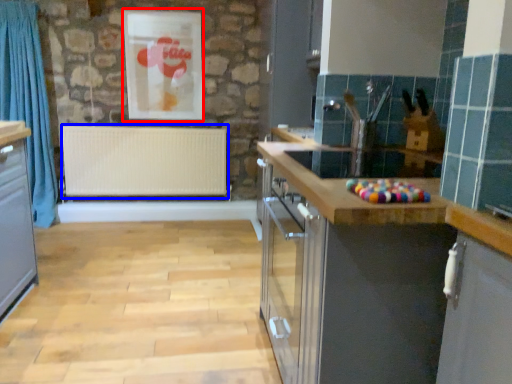
Question: Which point is closer to the camera, picture frame (highlighted by a red box) or radiator (highlighted by a blue box)?

Choices:
 (A) picture frame
 (B) radiator

Answer: (A)